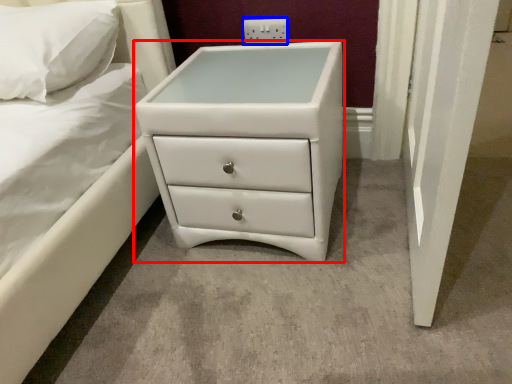
Question: Which point is closer to the camera, chest of drawers (highlighted by a red box) or electric outlet (highlighted by a blue box)?

Choices:
 (A) chest of drawers
 (B) electric outlet

Answer: (A)